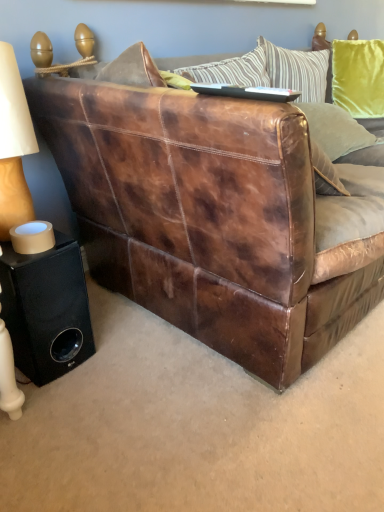
Question: Is velvet green pillow at upper right to the right of brown leather couch at center from the viewer's perspective?

Choices:
 (A) no
 (B) yes

Answer: (B)

Question: Can you confirm if velvet green pillow at upper right is taller than brown leather couch at center?

Choices:
 (A) yes
 (B) no

Answer: (B)

Question: Is velvet green pillow at upper right completely or partially outside of brown leather couch at center?

Choices:
 (A) yes
 (B) no

Answer: (B)

Question: From the image's perspective, is velvet green pillow at upper right on top of brown leather couch at center?

Choices:
 (A) no
 (B) yes

Answer: (B)

Question: Is velvet green pillow at upper right aimed at brown leather couch at center?

Choices:
 (A) yes
 (B) no

Answer: (A)

Question: Does velvet green pillow at upper right have a lesser height compared to brown leather couch at center?

Choices:
 (A) yes
 (B) no

Answer: (A)

Question: Is brown leather couch at center to the left of matte beige lampshade at left from the viewer's perspective?

Choices:
 (A) no
 (B) yes

Answer: (A)

Question: Is there a large distance between brown leather couch at center and matte beige lampshade at left?

Choices:
 (A) no
 (B) yes

Answer: (A)

Question: Is brown leather couch at center facing away from matte beige lampshade at left?

Choices:
 (A) yes
 (B) no

Answer: (B)

Question: Is brown leather couch at center taller than matte beige lampshade at left?

Choices:
 (A) no
 (B) yes

Answer: (B)

Question: Does brown leather couch at center have a larger size compared to matte beige lampshade at left?

Choices:
 (A) no
 (B) yes

Answer: (B)

Question: Does brown leather couch at center appear on the right side of matte beige lampshade at left?

Choices:
 (A) no
 (B) yes

Answer: (B)

Question: Is matte beige lampshade at left at the right side of brown leather couch at center?

Choices:
 (A) no
 (B) yes

Answer: (A)